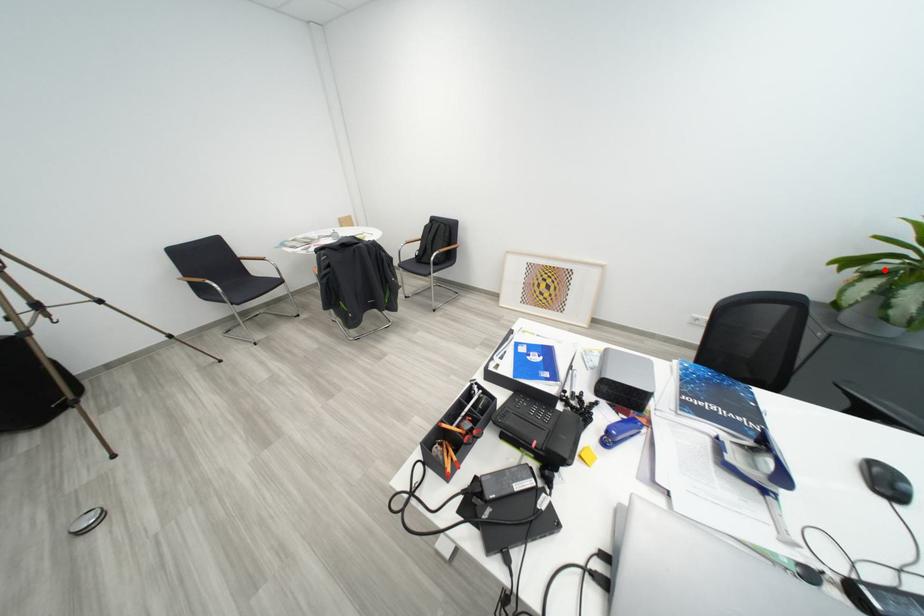
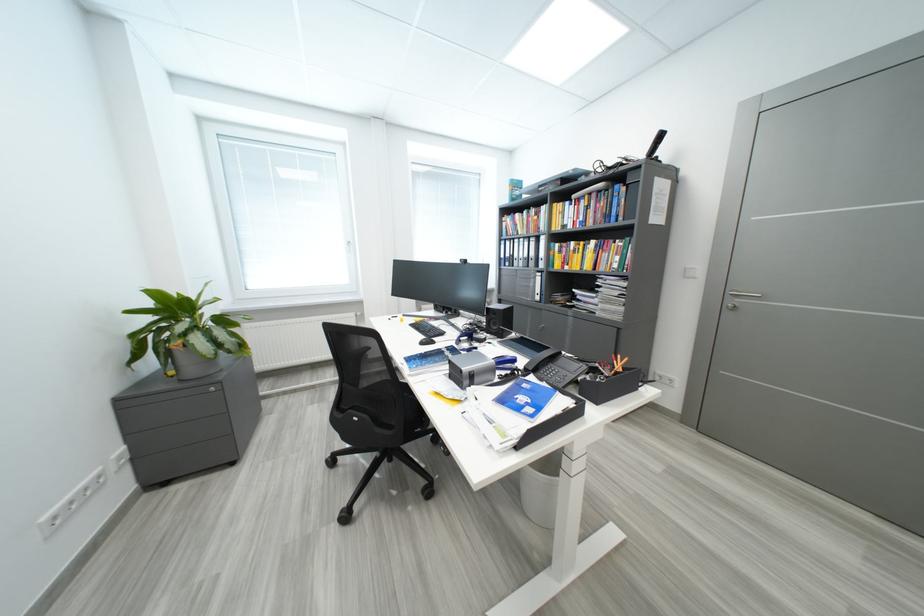
Locate, in the second image, the point that corresponds to the highlighted location in the first image.

(189, 331)